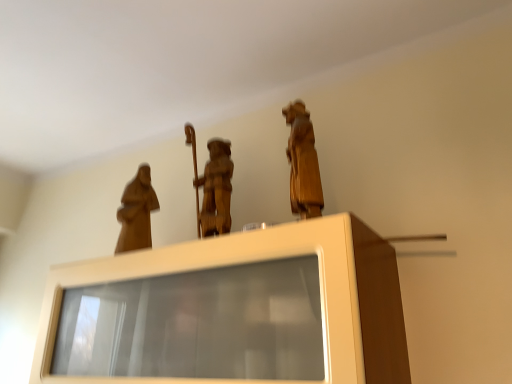
Question: Looking at the image, does wooden statue at upper center, the first person viewed from the right, seem bigger or smaller compared to matte wood statue at left, the second person in the right-to-left sequence?

Choices:
 (A) small
 (B) big

Answer: (B)

Question: Is point (303, 102) closer or farther from the camera than point (146, 195)?

Choices:
 (A) farther
 (B) closer

Answer: (B)

Question: Estimate the real-world distances between objects in this image. Which object is closer to the wooden statue at upper center, the 2th person viewed from the left?

Choices:
 (A) matte wood statue at left, marked as the second person in a front-to-back arrangement
 (B) matte wood cabinet at center

Answer: (B)

Question: Considering the real-world distances, which object is farthest from the matte wood cabinet at center?

Choices:
 (A) wooden statue at upper center, the 2th person viewed from the left
 (B) matte wood statue at left, marked as the second person in a front-to-back arrangement

Answer: (B)